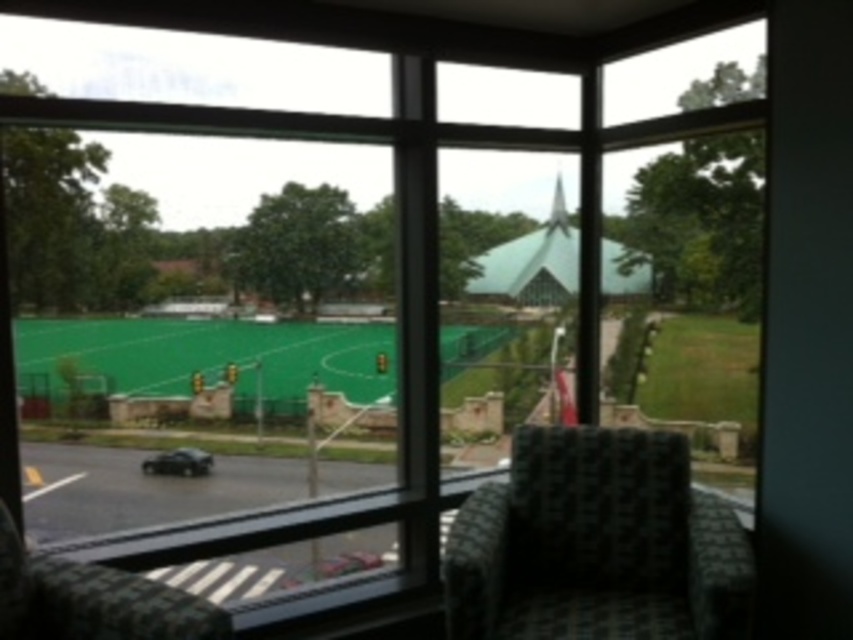
You are sitting in the patterned fabric chair at lower left and want to see the triangular roof building in the background. Is the green artificial turf at center blocking your view?

The green artificial turf at center is positioned over the patterned fabric chair at lower left, so it would block your view of the triangular roof building in the background.

You are an interior designer planning to place a new sofa in the room. The room has a green artificial turf at center and a patterned fabric chair at lower left. Which object takes up more space in the room?

The green artificial turf at center takes up more space in the room as it is bigger than the patterned fabric chair at lower left.